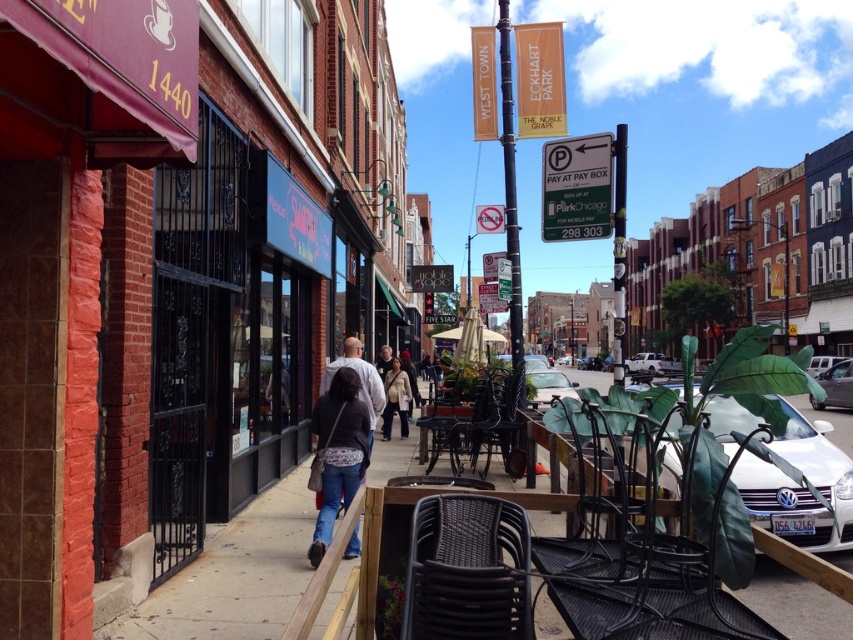
Looking at this image, you are a window cleaner standing on the sidewalk and need to clean the matte black awning at upper left and the metallic black chair at center. Which object requires you to climb higher to reach?

The matte black awning at upper left requires climbing higher to reach because it is positioned at the upper left of the scene, higher than the metallic black chair at center which is located at the center.

You are standing at the camera position looking at the urban street scene. There is a specific point marked at coordinates point (x=96, y=544). If you want to place a 10 feet long banner from this point towards the camera, will the banner reach the camera position?

The distance between point (x=96, y=544) and the camera is 15.72 feet. Since the banner is 10 feet long, it will not reach the camera position as the distance is greater than the banner length.

You are a painter standing on the sidewalk and want to paint the matte black awning at upper left and the metallic black chair at center. Which object will require you to lift your brush higher?

The matte black awning at upper left is taller than the metallic black chair at center, so you will need to lift your brush higher to paint the matte black awning at upper left.